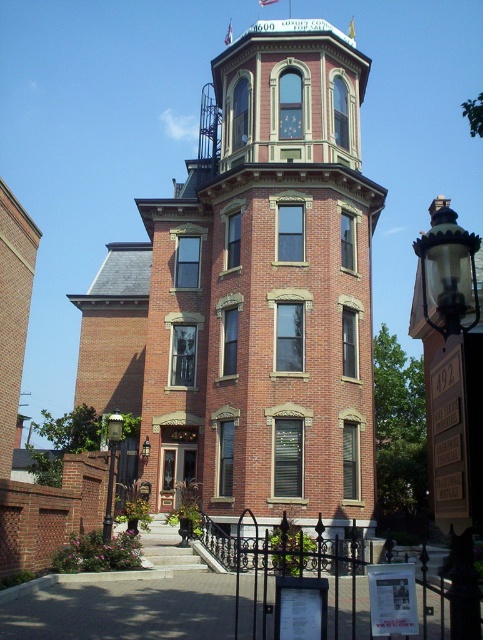
Question: Is black metal streetlamp at lower left above matte black lamp at upper center?

Choices:
 (A) yes
 (B) no

Answer: (B)

Question: From the image, what is the correct spatial relationship of black metal streetlamp at lower left in relation to matte black lamp at upper center?

Choices:
 (A) right
 (B) left

Answer: (B)

Question: Considering the real-world distances, which object is farthest from the matte glass clock at upper center?

Choices:
 (A) matte black lamp at upper center
 (B) black metal streetlamp at lower left

Answer: (B)

Question: Does black metal streetlamp at lower left appear on the right side of matte glass clock at upper center?

Choices:
 (A) yes
 (B) no

Answer: (B)

Question: Considering the real-world distances, which object is closest to the matte glass clock at upper center?

Choices:
 (A) matte black lamp at upper center
 (B) black metal streetlamp at lower left

Answer: (A)

Question: Based on their relative distances, which object is farther from the matte black lamp at upper center?

Choices:
 (A) matte glass clock at upper center
 (B) black metal streetlamp at lower left

Answer: (A)